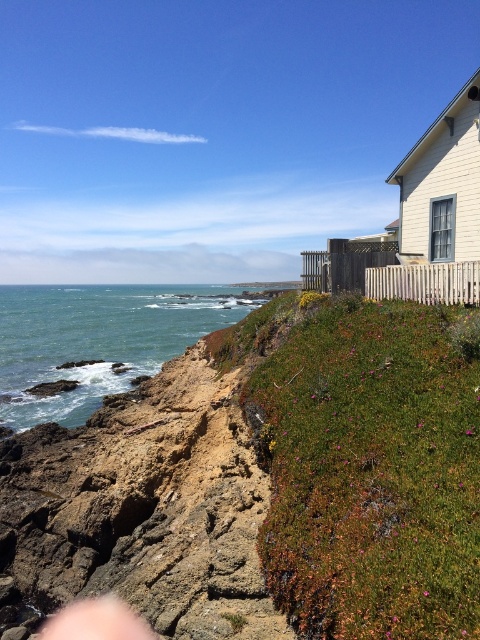
You are standing in the coastal scene and want to take a photo of both the green grassy hillside at upper right and the green water at lower left. Which object should you focus on first to ensure both are in the frame?

You should focus on the green grassy hillside at upper right first because it is closer to the viewer than the green water at lower left, so adjusting the camera to include the closer object first will help frame both properly.

In the scene shown: You are standing at the center of the image and want to reach the green water at lower left. Which direction should you move to get closer to it, while avoiding the green grassy hillside at upper right?

To reach the green water at lower left while avoiding the green grassy hillside at upper right, you should move downward and to the left, as the green water at lower left is positioned below and to the left of your current position, and the green grassy hillside at upper right is higher and to the right, so moving in the opposite direction would keep you away from it.

You are standing at the center of the coastal scene and want to reach the green grassy hillside at upper right. Which direction should you walk to avoid the green water at lower left?

You should walk to the right to reach the green grassy hillside at upper right and avoid the green water at lower left, as the green grassy hillside at upper right is located to the right of the green water at lower left.